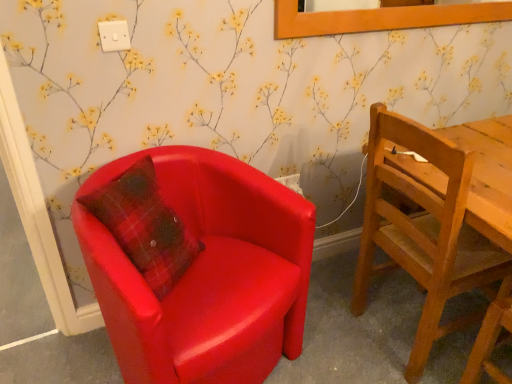
Question: Does white plastic power outlet at upper center, which ranks as the 2th power outlet in bottom-to-top order, lie behind matte red armchair at left, arranged as the first chair when viewed from the left?

Choices:
 (A) no
 (B) yes

Answer: (B)

Question: Is white plastic power outlet at upper center, the second power outlet from the right, smaller than matte red armchair at left, arranged as the first chair when viewed from the left?

Choices:
 (A) no
 (B) yes

Answer: (B)

Question: Considering the relative sizes of white plastic power outlet at upper center, the first power outlet viewed from the left, and matte red armchair at left, arranged as the first chair when viewed from the left, in the image provided, is white plastic power outlet at upper center, the first power outlet viewed from the left, wider than matte red armchair at left, arranged as the first chair when viewed from the left,?

Choices:
 (A) yes
 (B) no

Answer: (B)

Question: Does white plastic power outlet at upper center, which ranks as the 2th power outlet in bottom-to-top order, have a lesser height compared to matte red armchair at left, arranged as the first chair when viewed from the left?

Choices:
 (A) no
 (B) yes

Answer: (B)

Question: Is white plastic power outlet at upper center, the first power outlet viewed from the left, positioned in front of matte red armchair at left, arranged as the first chair when viewed from the left?

Choices:
 (A) no
 (B) yes

Answer: (A)

Question: Considering the relative sizes of white plastic power outlet at upper center, the first power outlet when ordered from top to bottom, and matte red armchair at left, arranged as the first chair when viewed from the left, in the image provided, is white plastic power outlet at upper center, the first power outlet when ordered from top to bottom, thinner than matte red armchair at left, arranged as the first chair when viewed from the left,?

Choices:
 (A) yes
 (B) no

Answer: (A)

Question: Is white plastic power outlet at upper center, the first power outlet when ordered from top to bottom, positioned beyond the bounds of wooden picture frame at upper center?

Choices:
 (A) no
 (B) yes

Answer: (B)

Question: Considering the relative sizes of white plastic power outlet at upper center, the first power outlet when ordered from top to bottom, and wooden picture frame at upper center in the image provided, is white plastic power outlet at upper center, the first power outlet when ordered from top to bottom, taller than wooden picture frame at upper center?

Choices:
 (A) no
 (B) yes

Answer: (A)

Question: Can you confirm if white plastic power outlet at upper center, the first power outlet viewed from the left, is bigger than wooden picture frame at upper center?

Choices:
 (A) yes
 (B) no

Answer: (B)

Question: Is white plastic power outlet at upper center, the second power outlet from the right, shorter than wooden picture frame at upper center?

Choices:
 (A) no
 (B) yes

Answer: (B)

Question: Considering the relative positions of white plastic power outlet at upper center, acting as the 1th power outlet starting from the front, and wooden picture frame at upper center in the image provided, is white plastic power outlet at upper center, acting as the 1th power outlet starting from the front, behind wooden picture frame at upper center?

Choices:
 (A) no
 (B) yes

Answer: (A)

Question: From the image's perspective, is white plastic power outlet at upper center, the 2th power outlet when ordered from back to front, located above wooden picture frame at upper center?

Choices:
 (A) no
 (B) yes

Answer: (A)

Question: Is matte red armchair at left, acting as the 2th chair starting from the right, taller than white plastic power outlet at upper center, the second power outlet from the right?

Choices:
 (A) yes
 (B) no

Answer: (A)